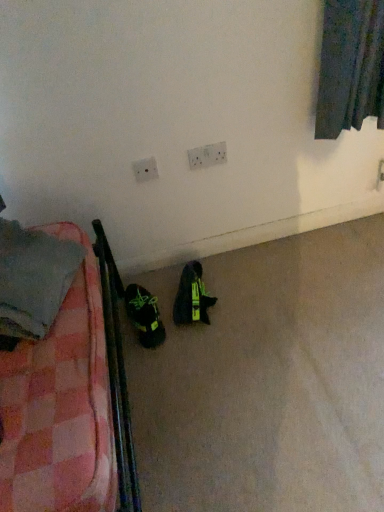
Question: From the image's perspective, does green matte sneakers at lower left, arranged as the 2th footwear when viewed from the right, appear higher than white plastic electric outlet at upper center, the 2th electric outlet in the left-to-right sequence?

Choices:
 (A) no
 (B) yes

Answer: (A)

Question: Is white plastic electric outlet at upper center, the first electric outlet from the right, completely or partially inside green matte sneakers at lower left, positioned as the first footwear in left-to-right order?

Choices:
 (A) no
 (B) yes

Answer: (A)

Question: From the image's perspective, is green matte sneakers at lower left, positioned as the first footwear in left-to-right order, located beneath white plastic electric outlet at upper center, the 2th electric outlet in the left-to-right sequence?

Choices:
 (A) yes
 (B) no

Answer: (A)

Question: Is green matte sneakers at lower left, arranged as the 2th footwear when viewed from the right, smaller than white plastic electric outlet at upper center, the first electric outlet from the right?

Choices:
 (A) no
 (B) yes

Answer: (A)

Question: Can you confirm if green matte sneakers at lower left, positioned as the first footwear in left-to-right order, is thinner than white plastic electric outlet at upper center, the 2th electric outlet in the left-to-right sequence?

Choices:
 (A) yes
 (B) no

Answer: (B)

Question: In terms of width, does white plastic electric outlet at upper center, which is the second electric outlet in right-to-left order, look wider or thinner when compared to plaid fabric blanket at left?

Choices:
 (A) wide
 (B) thin

Answer: (B)

Question: Is point (137, 160) positioned closer to the camera than point (46, 309)?

Choices:
 (A) closer
 (B) farther

Answer: (B)

Question: Considering their positions, is white plastic electric outlet at upper center, which is the second electric outlet in right-to-left order, located in front of or behind plaid fabric blanket at left?

Choices:
 (A) front
 (B) behind

Answer: (B)

Question: From a real-world perspective, is white plastic electric outlet at upper center, which is the second electric outlet in right-to-left order, positioned above or below plaid fabric blanket at left?

Choices:
 (A) above
 (B) below

Answer: (B)

Question: Is white plastic electric outlet at upper center, the 1th electric outlet in the left-to-right sequence, bigger or smaller than green matte sneakers at lower left, positioned as the first footwear in left-to-right order?

Choices:
 (A) small
 (B) big

Answer: (A)

Question: Does point (152, 167) appear closer or farther from the camera than point (157, 324)?

Choices:
 (A) farther
 (B) closer

Answer: (B)

Question: From their relative heights in the image, would you say white plastic electric outlet at upper center, which is the second electric outlet in right-to-left order, is taller or shorter than green matte sneakers at lower left, positioned as the first footwear in left-to-right order?

Choices:
 (A) tall
 (B) short

Answer: (B)

Question: From a real-world perspective, is white plastic electric outlet at upper center, which is the second electric outlet in right-to-left order, physically located above or below green matte sneakers at lower left, positioned as the first footwear in left-to-right order?

Choices:
 (A) above
 (B) below

Answer: (A)

Question: Based on their sizes in the image, would you say white plastic electric outlet at upper center, the first electric outlet from the right, is bigger or smaller than plaid fabric blanket at left?

Choices:
 (A) big
 (B) small

Answer: (B)

Question: Considering their positions, is white plastic electric outlet at upper center, the first electric outlet from the right, located in front of or behind plaid fabric blanket at left?

Choices:
 (A) front
 (B) behind

Answer: (B)